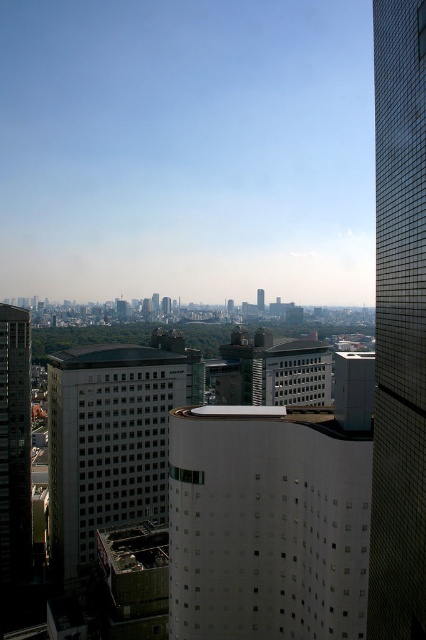
Question: Which object is positioned closest to the glassy reflective skyscraper at right?

Choices:
 (A) white glass building at center
 (B) white smooth building at center

Answer: (B)

Question: Which point is closer to the camera?

Choices:
 (A) white glass building at center
 (B) white smooth building at center

Answer: (B)

Question: Can you confirm if glassy reflective skyscraper at right is smaller than white glass building at center?

Choices:
 (A) no
 (B) yes

Answer: (B)

Question: Can you confirm if white smooth building at center is bigger than glassy reflective skyscraper at right?

Choices:
 (A) no
 (B) yes

Answer: (A)

Question: Which point appears closest to the camera in this image?

Choices:
 (A) (112, 461)
 (B) (222, 461)
 (C) (402, 212)

Answer: (C)

Question: Can you confirm if white smooth building at center is positioned to the left of white glass building at center?

Choices:
 (A) no
 (B) yes

Answer: (A)